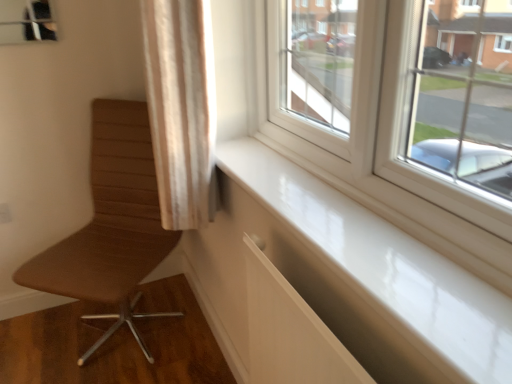
Question: From a real-world perspective, is white glossy window sill at lower right positioned above or below beige fabric curtain at upper left?

Choices:
 (A) above
 (B) below

Answer: (B)

Question: Is white glossy window sill at lower right taller or shorter than beige fabric curtain at upper left?

Choices:
 (A) tall
 (B) short

Answer: (B)

Question: Estimate the real-world distances between objects in this image. Which object is farther from the beige fabric curtain at upper left?

Choices:
 (A) white glossy window sill at lower right
 (B) brown leather chair at left

Answer: (B)

Question: Estimate the real-world distances between objects in this image. Which object is farther from the brown leather chair at left?

Choices:
 (A) beige fabric curtain at upper left
 (B) white glossy window sill at lower right

Answer: (B)